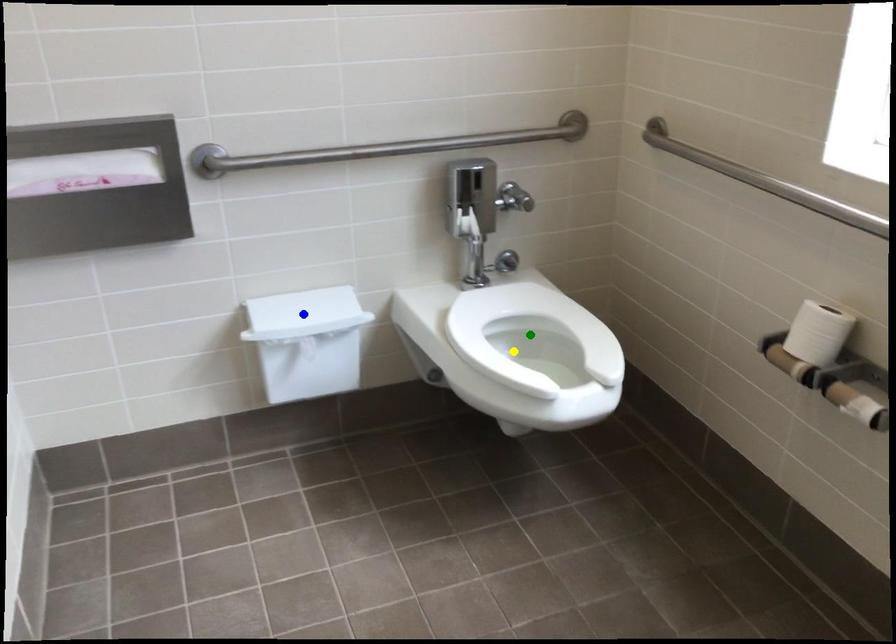
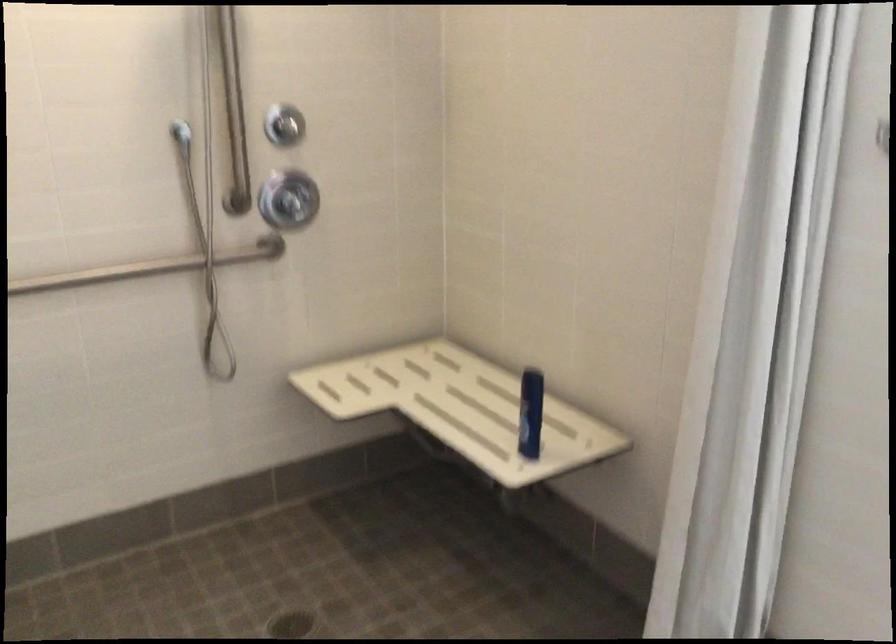
I am providing you with two images of the same scene from different viewpoints. Three points are marked in image1. Which point corresponds to a part or object that is occluded in image2?In image1, three points are marked. Which of them correspond to a part or object that is occluded in image2?Among the three points shown in image1, which one corresponds to a part or object that is no longer visible due to occlusion in image2?

Invisible in image2: green point, yellow point, blue point.